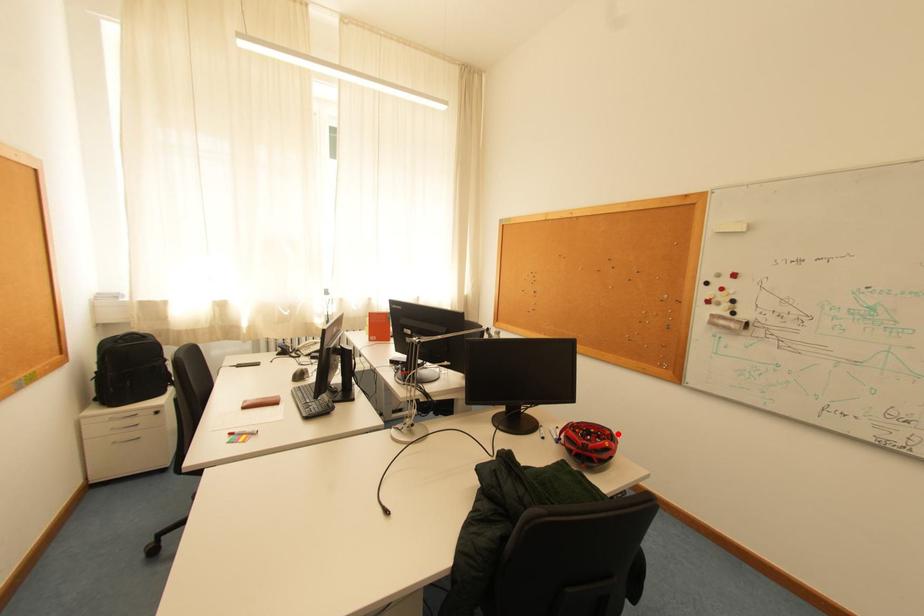
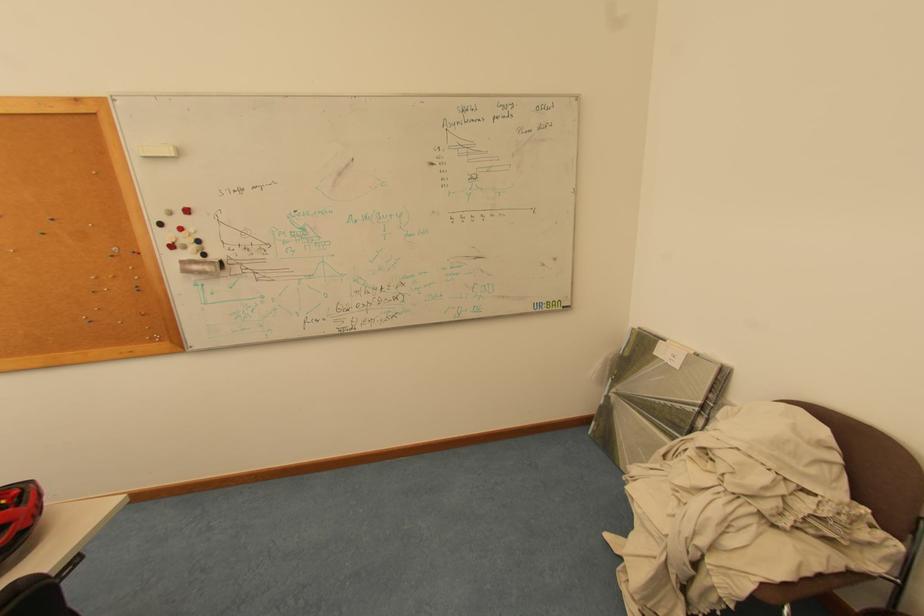
Where in the second image is the point corresponding to the highlighted location from the first image?

(25, 493)